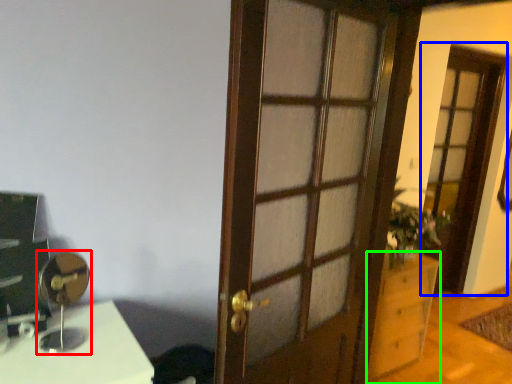
Question: Considering the real-world distances, which object is closest to table lamp (highlighted by a red box)? screen door (highlighted by a blue box) or cabinetry (highlighted by a green box).

Choices:
 (A) screen door
 (B) cabinetry

Answer: (B)